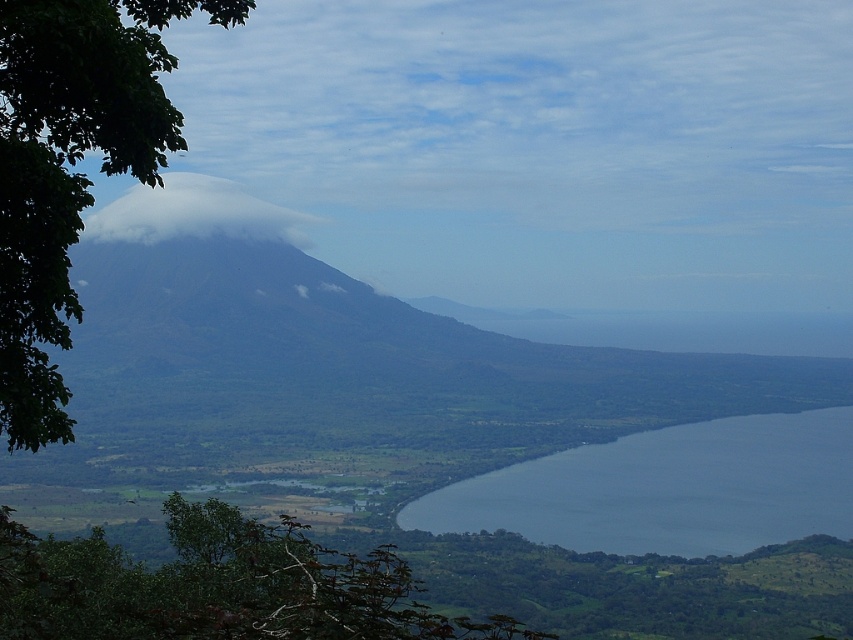
Between point (62, 70) and point (149, 230), which one is positioned in front?

Point (62, 70)

Does green leafy tree at left have a smaller size compared to white fluffy cloud at left?

Yes, green leafy tree at left is smaller than white fluffy cloud at left.

Is point (120, 67) behind point (138, 240)?

No, it is not.

Locate an element on the screen. green leafy tree at left is located at coordinates (70, 166).

Can you confirm if blue water at lower right is shorter than white fluffy cloud at left?

Yes.

Can you confirm if blue water at lower right is positioned to the right of white fluffy cloud at left?

Correct, you'll find blue water at lower right to the right of white fluffy cloud at left.

Is point (602, 480) closer to camera compared to point (93, 236)?

Yes, point (602, 480) is in front of point (93, 236).

The image size is (853, 640). What are the coordinates of `blue water at lower right` in the screenshot? It's located at (666, 488).

Who is more forward, [126,634] or [523,512]?

Point [126,634] is in front.

Can you confirm if green leafy tree at lower left is positioned below blue water at lower right?

Incorrect, green leafy tree at lower left is not positioned below blue water at lower right.

I want to click on green leafy tree at lower left, so click(218, 586).